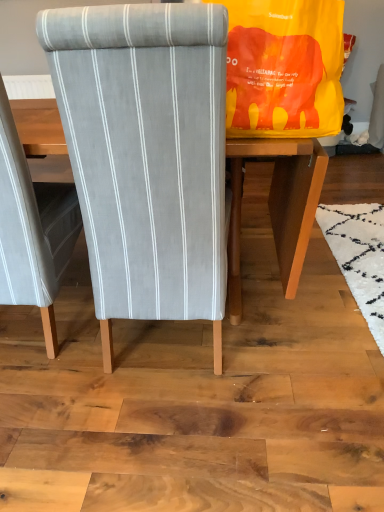
The height and width of the screenshot is (512, 384). What do you see at coordinates (32, 229) in the screenshot?
I see `textured gray fabric chair at center, which is counted as the 1th chair, starting from the left` at bounding box center [32, 229].

Where is `gray fabric chair at center, the 1th chair from the right`? This screenshot has height=512, width=384. gray fabric chair at center, the 1th chair from the right is located at coordinates (147, 156).

Find the location of a particular element. Image resolution: width=384 pixels, height=512 pixels. textured gray fabric chair at center, placed as the 2th chair when sorted from right to left is located at coordinates (32, 229).

Is point (51, 305) more distant than point (213, 303)?

Yes, point (51, 305) is behind point (213, 303).

Based on their positions, is textured gray fabric chair at center, which is counted as the 1th chair, starting from the left, located to the left or right of gray fabric chair at center, the 1th chair from the right?

textured gray fabric chair at center, which is counted as the 1th chair, starting from the left, is to the left of gray fabric chair at center, the 1th chair from the right.

Considering the sizes of objects textured gray fabric chair at center, placed as the 2th chair when sorted from right to left, and gray fabric chair at center, the 1th chair from the right, in the image provided, who is bigger, textured gray fabric chair at center, placed as the 2th chair when sorted from right to left, or gray fabric chair at center, the 1th chair from the right,?

textured gray fabric chair at center, placed as the 2th chair when sorted from right to left, is bigger.

What's the angular difference between textured gray fabric chair at center, which is counted as the 1th chair, starting from the left, and gray fabric chair at center, the 1th chair from the right,'s facing directions?

There is a 5.54e-05-degree angle between the facing directions of textured gray fabric chair at center, which is counted as the 1th chair, starting from the left, and gray fabric chair at center, the 1th chair from the right.

Consider the image. From the image's perspective, is yellow fabric bag at upper right located above textured gray fabric chair at center, placed as the 2th chair when sorted from right to left?

Yes, from the image's perspective, yellow fabric bag at upper right is on top of textured gray fabric chair at center, placed as the 2th chair when sorted from right to left.

Is yellow fabric bag at upper right with textured gray fabric chair at center, which is counted as the 1th chair, starting from the left?

No, yellow fabric bag at upper right is not beside textured gray fabric chair at center, which is counted as the 1th chair, starting from the left.

From a real-world perspective, is yellow fabric bag at upper right above or below textured gray fabric chair at center, which is counted as the 1th chair, starting from the left?

yellow fabric bag at upper right is above textured gray fabric chair at center, which is counted as the 1th chair, starting from the left.

Could you tell me if gray fabric chair at center, which appears as the second chair when viewed from the left, is turned towards yellow fabric bag at upper right?

No, gray fabric chair at center, which appears as the second chair when viewed from the left, is not turned towards yellow fabric bag at upper right.

From a real-world perspective, who is located lower, gray fabric chair at center, the 1th chair from the right, or yellow fabric bag at upper right?

gray fabric chair at center, the 1th chair from the right, is physically lower.

How different are the orientations of gray fabric chair at center, the 1th chair from the right, and yellow fabric bag at upper right in degrees?

There is a 84.9-degree angle between the facing directions of gray fabric chair at center, the 1th chair from the right, and yellow fabric bag at upper right.

Considering the relative sizes of gray fabric chair at center, the 1th chair from the right, and yellow fabric bag at upper right in the image provided, is gray fabric chair at center, the 1th chair from the right, wider than yellow fabric bag at upper right?

Correct, the width of gray fabric chair at center, the 1th chair from the right, exceeds that of yellow fabric bag at upper right.

Between point (257, 118) and point (204, 209), which one is positioned in front?

The point (204, 209) is more forward.

Who is smaller, yellow fabric bag at upper right or gray fabric chair at center, which appears as the second chair when viewed from the left?

yellow fabric bag at upper right.

Which object is wider, yellow fabric bag at upper right or gray fabric chair at center, which appears as the second chair when viewed from the left?

gray fabric chair at center, which appears as the second chair when viewed from the left, is wider.

Does yellow fabric bag at upper right lie in front of gray fabric chair at center, the 1th chair from the right?

No, yellow fabric bag at upper right is further to the viewer.

Considering the points (217, 19) and (46, 269), which point is behind, point (217, 19) or point (46, 269)?

The point (46, 269) is behind.

Is textured gray fabric chair at center, which is counted as the 1th chair, starting from the left, a part of gray fabric chair at center, the 1th chair from the right?

That's incorrect, textured gray fabric chair at center, which is counted as the 1th chair, starting from the left, is not inside gray fabric chair at center, the 1th chair from the right.

Does gray fabric chair at center, the 1th chair from the right, turn towards textured gray fabric chair at center, which is counted as the 1th chair, starting from the left?

No, gray fabric chair at center, the 1th chair from the right, is not facing towards textured gray fabric chair at center, which is counted as the 1th chair, starting from the left.

Is textured gray fabric chair at center, which is counted as the 1th chair, starting from the left, not close to yellow fabric bag at upper right?

No, textured gray fabric chair at center, which is counted as the 1th chair, starting from the left, is in close proximity to yellow fabric bag at upper right.

Identify the location of bag lying behind the textured gray fabric chair at center, placed as the 2th chair when sorted from right to left. The height and width of the screenshot is (512, 384). (284, 68).

Is textured gray fabric chair at center, which is counted as the 1th chair, starting from the left, shorter than yellow fabric bag at upper right?

No.

You are a GUI agent. You are given a task and a screenshot of the screen. Output one action in this format:
    pyautogui.click(x=<x>, y=<y>)
    Task: Click on the chair behind the gray fabric chair at center, the 1th chair from the right
    This screenshot has height=512, width=384.
    Given the screenshot: What is the action you would take?
    pyautogui.click(x=32, y=229)

This screenshot has width=384, height=512. In the image, there is a textured gray fabric chair at center, placed as the 2th chair when sorted from right to left. Identify the location of bag above it (from the image's perspective). pos(284,68).

From the image, which object appears to be farther from yellow fabric bag at upper right, textured gray fabric chair at center, placed as the 2th chair when sorted from right to left, or gray fabric chair at center, the 1th chair from the right?

textured gray fabric chair at center, placed as the 2th chair when sorted from right to left.

From the image, which object appears to be farther from gray fabric chair at center, the 1th chair from the right, yellow fabric bag at upper right or textured gray fabric chair at center, placed as the 2th chair when sorted from right to left?

yellow fabric bag at upper right is further to gray fabric chair at center, the 1th chair from the right.

Based on their spatial positions, is yellow fabric bag at upper right or gray fabric chair at center, which appears as the second chair when viewed from the left, closer to textured gray fabric chair at center, placed as the 2th chair when sorted from right to left?

The object closer to textured gray fabric chair at center, placed as the 2th chair when sorted from right to left, is gray fabric chair at center, which appears as the second chair when viewed from the left.

When comparing their distances from gray fabric chair at center, the 1th chair from the right, does textured gray fabric chair at center, which is counted as the 1th chair, starting from the left, or yellow fabric bag at upper right seem further?

yellow fabric bag at upper right is positioned further to the anchor gray fabric chair at center, the 1th chair from the right.

Based on their spatial positions, is gray fabric chair at center, which appears as the second chair when viewed from the left, or textured gray fabric chair at center, which is counted as the 1th chair, starting from the left, closer to yellow fabric bag at upper right?

The object closer to yellow fabric bag at upper right is gray fabric chair at center, which appears as the second chair when viewed from the left.

Estimate the real-world distances between objects in this image. Which object is further from textured gray fabric chair at center, which is counted as the 1th chair, starting from the left, gray fabric chair at center, the 1th chair from the right, or yellow fabric bag at upper right?

Based on the image, yellow fabric bag at upper right appears to be further to textured gray fabric chair at center, which is counted as the 1th chair, starting from the left.

I want to click on chair situated between textured gray fabric chair at center, which is counted as the 1th chair, starting from the left, and yellow fabric bag at upper right from left to right, so click(x=147, y=156).